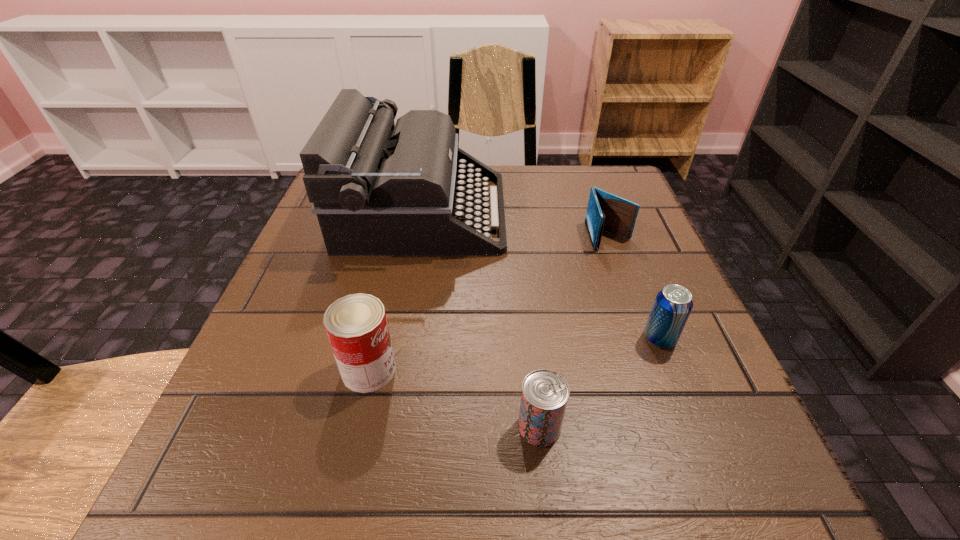
Locate an element on the screen. free region located 0.280m on the exterior surface of the wallet is located at coordinates (656, 366).

This screenshot has width=960, height=540. Find the location of `object present at the far edge`. object present at the far edge is located at coordinates (378, 188).

The width and height of the screenshot is (960, 540). I want to click on object situated at the near edge, so tap(545, 393).

Locate an element on the screen. typewriter at the left edge is located at coordinates (378, 188).

Locate an element on the screen. The image size is (960, 540). can located at the left edge is located at coordinates (356, 325).

Find the location of a particular element. beer can located in the right edge section of the desktop is located at coordinates (673, 304).

Image resolution: width=960 pixels, height=540 pixels. What are the coordinates of `wallet that is at the right edge` in the screenshot? It's located at (605, 211).

The image size is (960, 540). Identify the location of object located in the far left corner section of the desktop. (378, 188).

At what (x,y) coordinates should I click in order to perform the action: click on vacant space at the far edge. Please return your answer as a coordinate pair (x, y). Looking at the image, I should click on (540, 201).

This screenshot has width=960, height=540. Identify the location of free space at the near edge of the desktop. (531, 500).